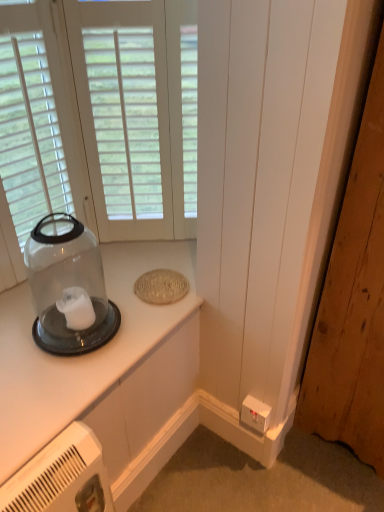
Question: Are white wood window at upper left and clear glass jar at upper left located far from each other?

Choices:
 (A) yes
 (B) no

Answer: (B)

Question: From a real-world perspective, is white wood window at upper left physically above clear glass jar at upper left?

Choices:
 (A) no
 (B) yes

Answer: (B)

Question: Can you confirm if white wood window at upper left is wider than clear glass jar at upper left?

Choices:
 (A) no
 (B) yes

Answer: (A)

Question: From a real-world perspective, is white wood window at upper left located beneath clear glass jar at upper left?

Choices:
 (A) yes
 (B) no

Answer: (B)

Question: Does white wood window at upper left lie in front of clear glass jar at upper left?

Choices:
 (A) yes
 (B) no

Answer: (B)

Question: From the image's perspective, would you say white wood window at upper left is shown under clear glass jar at upper left?

Choices:
 (A) yes
 (B) no

Answer: (B)

Question: Could you tell me if white plastic electric outlet at lower right is turned towards clear glass jar at upper left?

Choices:
 (A) yes
 (B) no

Answer: (B)

Question: Can you confirm if white plastic electric outlet at lower right is bigger than clear glass jar at upper left?

Choices:
 (A) no
 (B) yes

Answer: (A)

Question: Is the position of white plastic electric outlet at lower right more distant than that of clear glass jar at upper left?

Choices:
 (A) no
 (B) yes

Answer: (B)

Question: Would you say white plastic electric outlet at lower right is outside clear glass jar at upper left?

Choices:
 (A) yes
 (B) no

Answer: (A)

Question: From the image's perspective, is white plastic electric outlet at lower right located beneath clear glass jar at upper left?

Choices:
 (A) yes
 (B) no

Answer: (A)

Question: Does white plastic electric outlet at lower right have a lesser width compared to clear glass jar at upper left?

Choices:
 (A) no
 (B) yes

Answer: (B)

Question: Would you say clear glass jar at upper left is part of wooden door at lower right's contents?

Choices:
 (A) no
 (B) yes

Answer: (A)